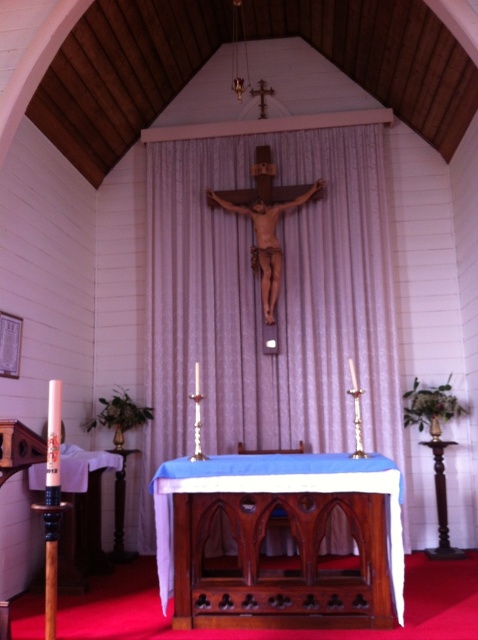
Question: Where is white fabric curtain at center located in relation to wooden altar at center in the image?

Choices:
 (A) above
 (B) below

Answer: (A)

Question: Does white fabric curtain at center come behind wooden altar at center?

Choices:
 (A) yes
 (B) no

Answer: (A)

Question: Can you confirm if white fabric curtain at center is bigger than wooden altar at center?

Choices:
 (A) no
 (B) yes

Answer: (B)